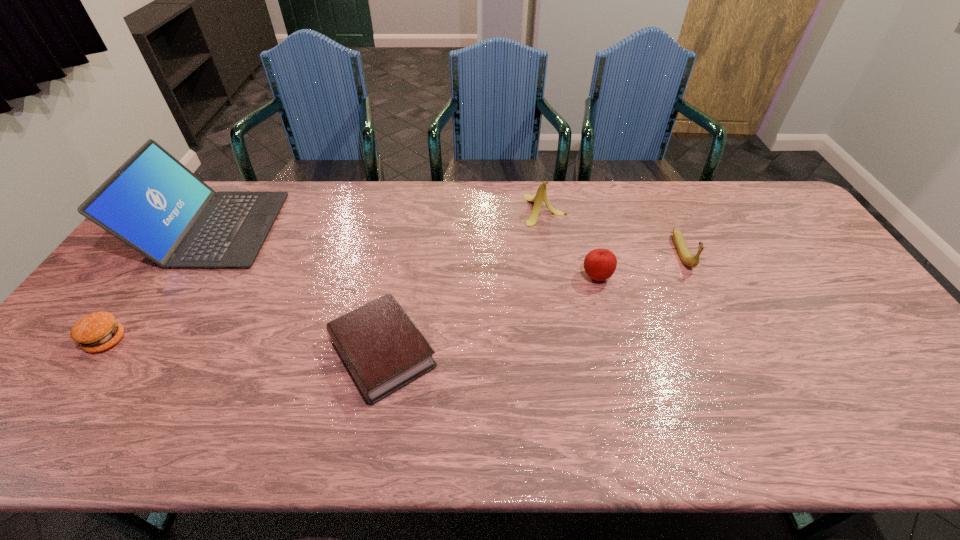
This screenshot has height=540, width=960. What are the coordinates of `free space at the far edge of the desktop` in the screenshot? It's located at (378, 181).

Where is `vacant space at the near edge`? vacant space at the near edge is located at coordinates (670, 416).

This screenshot has height=540, width=960. What are the coordinates of `free space at the left edge` in the screenshot? It's located at (83, 395).

The image size is (960, 540). I want to click on free space at the right edge, so click(x=922, y=404).

What are the coordinates of `vacant space at the far right corner of the desktop` in the screenshot? It's located at (772, 216).

At what (x,y) coordinates should I click in order to perform the action: click on blank region between the fourth object from right to left and the farther banana. Please return your answer as a coordinate pair (x, y). The image size is (960, 540). Looking at the image, I should click on (464, 281).

The width and height of the screenshot is (960, 540). In order to click on empty location between the Bible and the patty in this screenshot , I will do click(x=245, y=347).

Find the location of a particular element. The image size is (960, 540). blank region between the left banana and the patty is located at coordinates (325, 275).

This screenshot has height=540, width=960. I want to click on blank region between the laptop computer and the rightmost object, so click(447, 241).

This screenshot has width=960, height=540. I want to click on free space that is in between the tallest object and the second tallest object, so click(379, 219).